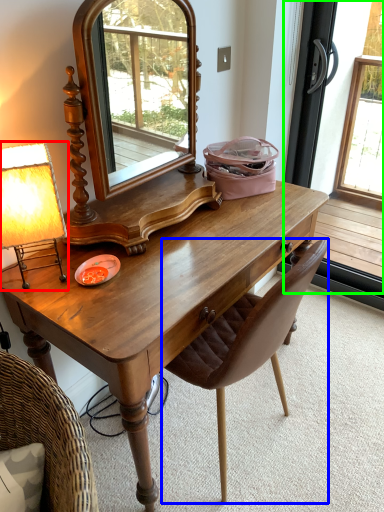
Question: Based on their relative distances, which object is farther from table lamp (highlighted by a red box)? Choose from chair (highlighted by a blue box) and screen door (highlighted by a green box).

Choices:
 (A) chair
 (B) screen door

Answer: (B)